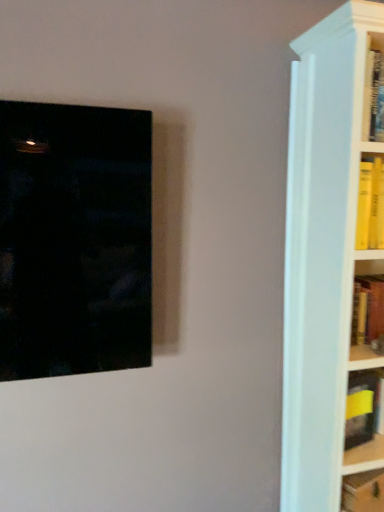
Question: Considering the relative sizes of yellow hardcover book at lower right, which appears as the 2th book when viewed from the top, and matte black picture frame at left in the image provided, is yellow hardcover book at lower right, which appears as the 2th book when viewed from the top, wider than matte black picture frame at left?

Choices:
 (A) no
 (B) yes

Answer: (B)

Question: Is yellow hardcover book at lower right, which appears as the 2th book when viewed from the top, positioned beyond the bounds of matte black picture frame at left?

Choices:
 (A) yes
 (B) no

Answer: (A)

Question: Are yellow hardcover book at lower right, the first book from the bottom, and matte black picture frame at left beside each other?

Choices:
 (A) yes
 (B) no

Answer: (B)

Question: From the image's perspective, is yellow hardcover book at lower right, which appears as the 2th book when viewed from the top, on matte black picture frame at left?

Choices:
 (A) yes
 (B) no

Answer: (B)

Question: From a real-world perspective, is yellow hardcover book at lower right, the first book from the bottom, physically above matte black picture frame at left?

Choices:
 (A) yes
 (B) no

Answer: (B)

Question: Is yellow hardcover book at lower right, which appears as the 2th book when viewed from the top, thinner than matte black picture frame at left?

Choices:
 (A) yes
 (B) no

Answer: (B)

Question: Can you confirm if yellow matte book at right, marked as the second book in a bottom-to-top arrangement, is bigger than matte black picture frame at left?

Choices:
 (A) yes
 (B) no

Answer: (B)

Question: Is yellow matte book at right, marked as the second book in a bottom-to-top arrangement, oriented towards matte black picture frame at left?

Choices:
 (A) no
 (B) yes

Answer: (A)

Question: Is yellow matte book at right, marked as the second book in a bottom-to-top arrangement, to the left of matte black picture frame at left from the viewer's perspective?

Choices:
 (A) yes
 (B) no

Answer: (B)

Question: Considering the relative sizes of yellow matte book at right, marked as the second book in a bottom-to-top arrangement, and matte black picture frame at left in the image provided, is yellow matte book at right, marked as the second book in a bottom-to-top arrangement, wider than matte black picture frame at left?

Choices:
 (A) yes
 (B) no

Answer: (B)

Question: Does yellow matte book at right, which is the first book from top to bottom, come behind matte black picture frame at left?

Choices:
 (A) yes
 (B) no

Answer: (A)

Question: Is yellow matte book at right, which is the first book from top to bottom, located outside matte black picture frame at left?

Choices:
 (A) no
 (B) yes

Answer: (B)

Question: Considering the relative sizes of matte black picture frame at left and yellow hardcover book at lower right, which appears as the 2th book when viewed from the top, in the image provided, is matte black picture frame at left bigger than yellow hardcover book at lower right, which appears as the 2th book when viewed from the top,?

Choices:
 (A) yes
 (B) no

Answer: (A)